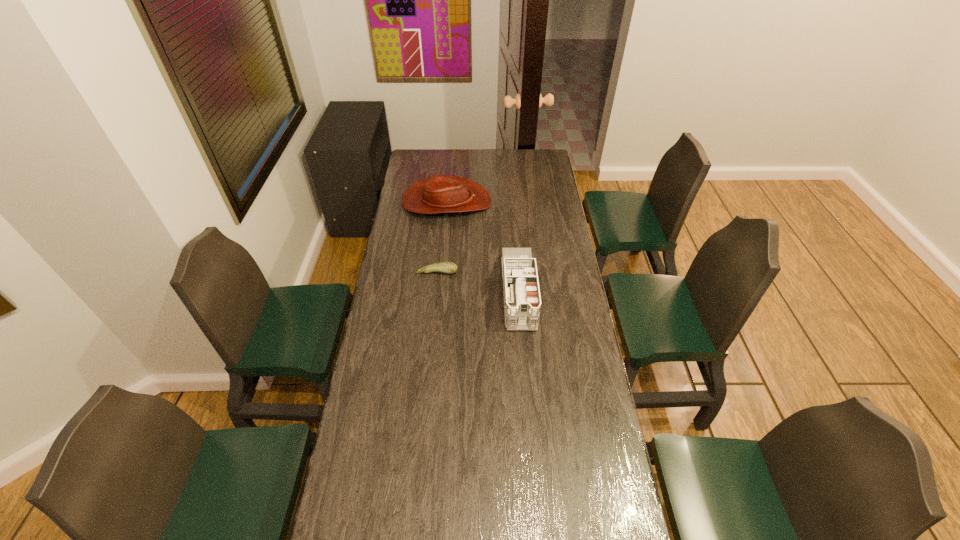
This screenshot has height=540, width=960. What are the coordinates of `the rightmost object` in the screenshot? It's located at (522, 302).

Where is `the second tallest object`? This screenshot has height=540, width=960. the second tallest object is located at coordinates (440, 193).

The image size is (960, 540). Find the location of `cowboy hat`. cowboy hat is located at coordinates (440, 193).

The image size is (960, 540). Find the location of `zucchini`. zucchini is located at coordinates (444, 267).

Identify the location of free region located 0.370m at the entrance of the rightmost object. The image size is (960, 540). (529, 424).

I want to click on free space located 0.230m on the front-facing side of the second tallest object, so click(536, 202).

I want to click on free space located at the stem end of the zucchini, so click(433, 316).

What are the coordinates of `cowboy hat that is at the left edge` in the screenshot? It's located at (440, 193).

Locate an element on the screen. This screenshot has width=960, height=540. zucchini that is at the left edge is located at coordinates (444, 267).

Find the location of `vacant region at the left edge`. vacant region at the left edge is located at coordinates (412, 304).